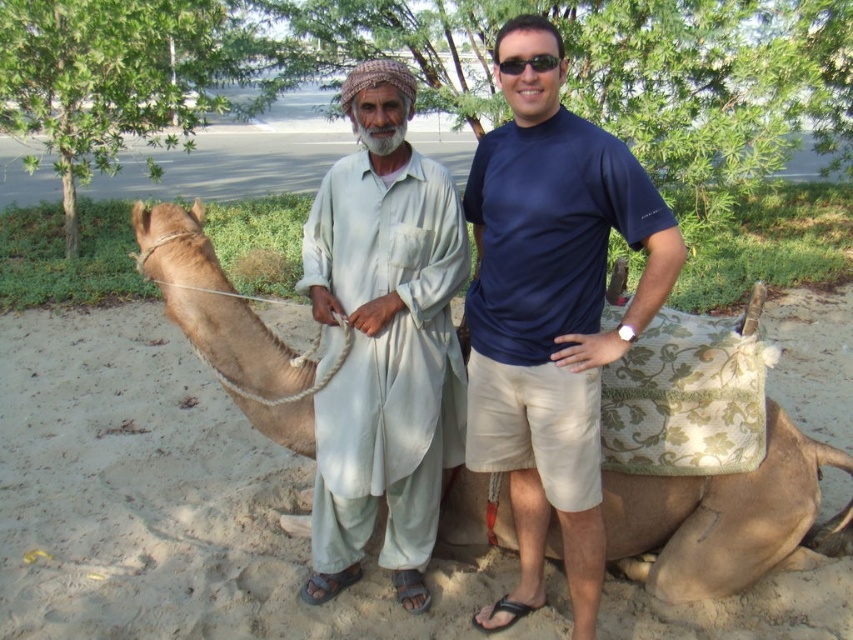
You are a photographer trying to capture a clear photo of the light brown camel at center and the black plastic sunglasses at center. Which object should you focus on first if you want to ensure both are in focus without adjusting the camera settings?

The light brown camel at center is below black plastic sunglasses at center, so you should focus on the black plastic sunglasses at center first since it is closer to the camera.

You are standing in the desert and see a point marked at coordinates [318,547]. If you want to place a 2.5 meter long tent there, will it fit without overlapping the camel or the people?

The point at [318,547] is 3.02 meters away from the viewer, so placing a 2.5 meter long tent there would require ensuring there is enough space around it. However, the description does not provide information about the proximity of the camel or the people to this point. Therefore, it is uncertain if the tent will fit without overlapping them.